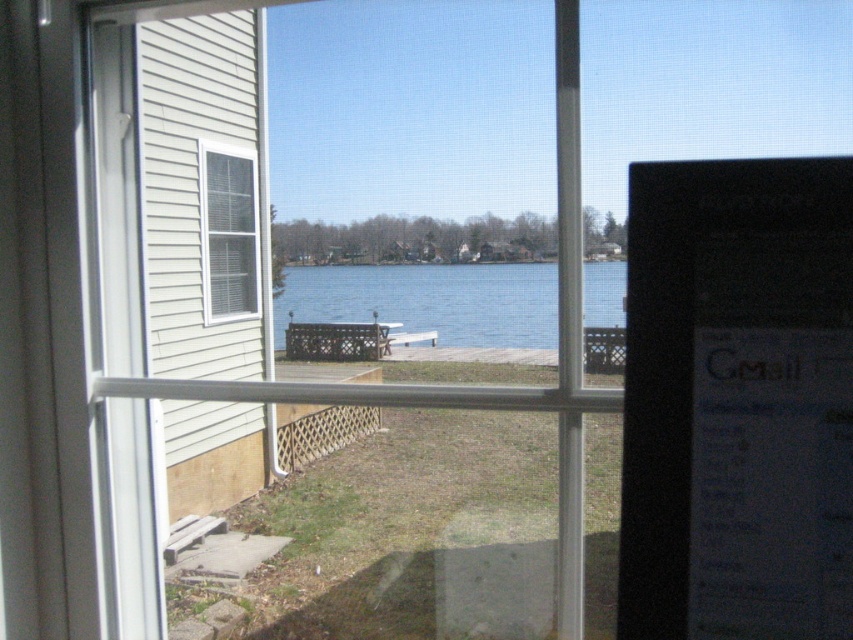
Can you confirm if blue water at center is positioned to the left of white plastic window at left?

In fact, blue water at center is to the right of white plastic window at left.

The height and width of the screenshot is (640, 853). What do you see at coordinates (431, 300) in the screenshot?
I see `blue water at center` at bounding box center [431, 300].

Who is more distant from viewer, (613, 301) or (218, 314)?

The point (613, 301) is behind.

You are a GUI agent. You are given a task and a screenshot of the screen. Output one action in this format:
    pyautogui.click(x=<x>, y=<y>)
    Task: Click on the blue water at center
    The height and width of the screenshot is (640, 853).
    Given the screenshot: What is the action you would take?
    pyautogui.click(x=431, y=300)

Who is higher up, black glossy monitor at right or blue water at center?

black glossy monitor at right

Image resolution: width=853 pixels, height=640 pixels. Find the location of `black glossy monitor at right`. black glossy monitor at right is located at coordinates (737, 401).

The image size is (853, 640). Describe the element at coordinates (737, 401) in the screenshot. I see `black glossy monitor at right` at that location.

Where is `black glossy monitor at right`? black glossy monitor at right is located at coordinates (737, 401).

Between black glossy monitor at right and white plastic window at left, which one is positioned lower?

black glossy monitor at right is below.

Does black glossy monitor at right lie in front of white plastic window at left?

That is True.

What are the coordinates of `black glossy monitor at right` in the screenshot? It's located at click(737, 401).

I want to click on black glossy monitor at right, so click(x=737, y=401).